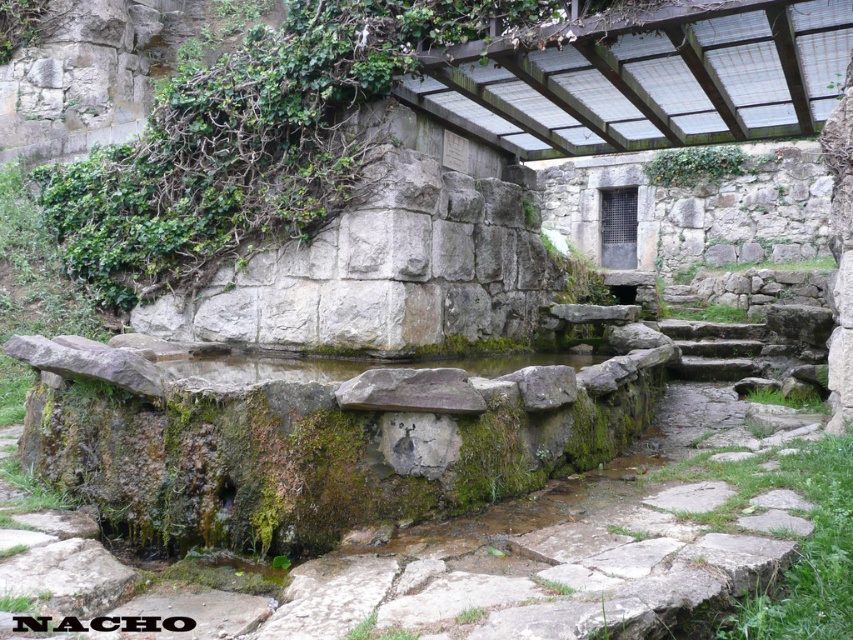
Which is in front, point (338, 371) or point (706, 170)?

Point (338, 371) is in front.

Can you confirm if clear stone water at center is positioned above green mossy vines at upper center?

No.

Describe the element at coordinates (349, 365) in the screenshot. I see `clear stone water at center` at that location.

Find the location of `clear stone water at center`. clear stone water at center is located at coordinates (349, 365).

Between gray rough stone wall at upper left and clear stone water at center, which one has more height?

Standing taller between the two is gray rough stone wall at upper left.

Which is behind, point (412, 188) or point (280, 358)?

The point (280, 358) is behind.

Does point (368, 218) come behind point (379, 362)?

Yes, point (368, 218) is farther from viewer.

The width and height of the screenshot is (853, 640). I want to click on gray rough stone wall at upper left, so click(x=381, y=269).

Is point (473, 301) closer to camera compared to point (695, 172)?

Yes, it is in front of point (695, 172).

Which is more to the right, gray rough stone wall at upper left or green mossy vines at upper center?

Positioned to the right is green mossy vines at upper center.

Between point (517, 236) and point (726, 145), which one is positioned in front?

Point (517, 236) is more forward.

Image resolution: width=853 pixels, height=640 pixels. What are the coordinates of `gray rough stone wall at upper left` in the screenshot? It's located at (381, 269).